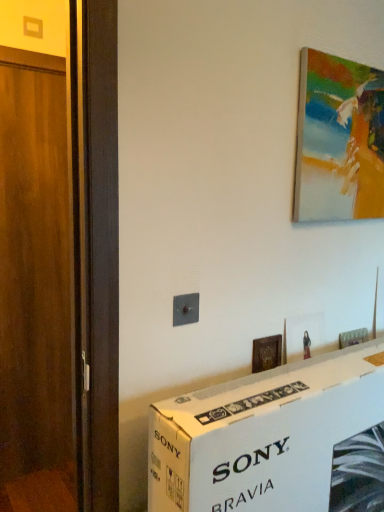
Question: Do you think wooden door at left is within painted canvas at upper right, the first picture frame when ordered from top to bottom, or outside of it?

Choices:
 (A) outside
 (B) inside

Answer: (A)

Question: From the image's perspective, is wooden door at left positioned above or below painted canvas at upper right, the first picture frame when ordered from top to bottom?

Choices:
 (A) above
 (B) below

Answer: (B)

Question: Estimate the real-world distances between objects in this image. Which object is farther from the wooden door at left?

Choices:
 (A) metallic switch at center
 (B) wooden picture frame at center, which ranks as the 2th picture frame in top-to-bottom order
 (C) painted canvas at upper right, the first picture frame when ordered from right to left
 (D) white cardboard box at lower center

Answer: (D)

Question: Which object is the closest to the painted canvas at upper right, the first picture frame when ordered from right to left?

Choices:
 (A) wooden door at left
 (B) metallic switch at center
 (C) white cardboard box at lower center
 (D) wooden picture frame at center, the 1th picture frame when ordered from left to right

Answer: (D)